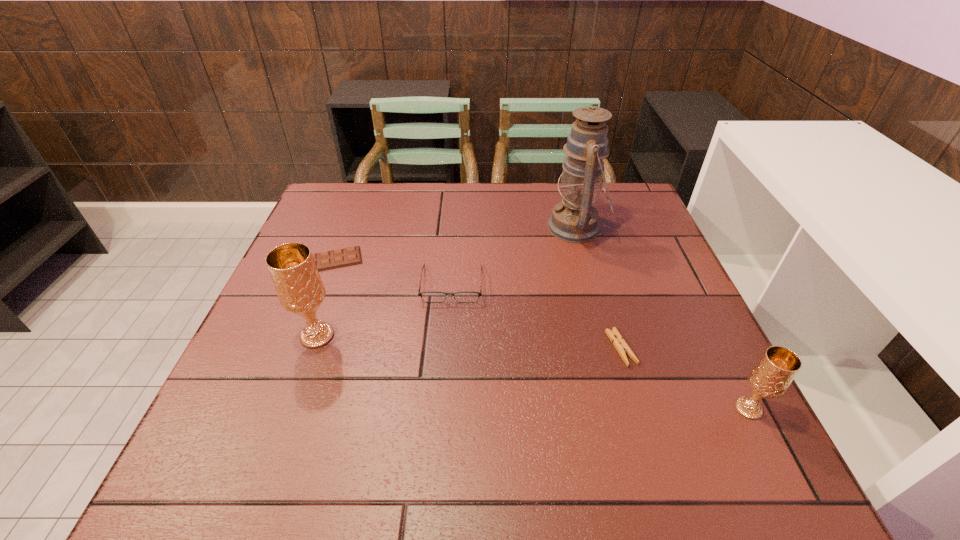
This screenshot has height=540, width=960. I want to click on oil lamp at the right edge, so click(x=574, y=219).

I want to click on object located in the far right corner section of the desktop, so click(x=574, y=219).

At what (x,y) coordinates should I click in order to perform the action: click on object that is at the near right corner. Please return your answer as a coordinate pair (x, y). Looking at the image, I should click on (771, 376).

Find the location of `vacant space at the far edge of the desktop`. vacant space at the far edge of the desktop is located at coordinates (404, 201).

Find the location of a particular element. free space at the near edge of the desktop is located at coordinates (534, 402).

Where is `free spot at the right edge of the desktop`? This screenshot has height=540, width=960. free spot at the right edge of the desktop is located at coordinates (660, 303).

Where is `vacant space at the far left corner`? vacant space at the far left corner is located at coordinates (369, 200).

Locate an element on the screen. vacant area between the farther chalice and the nearest object is located at coordinates (533, 372).

Where is `vacant area that lies between the shorter chalice and the chocolate bar`? vacant area that lies between the shorter chalice and the chocolate bar is located at coordinates (540, 334).

This screenshot has width=960, height=540. I want to click on empty location between the spectacles and the nearest object, so click(x=600, y=346).